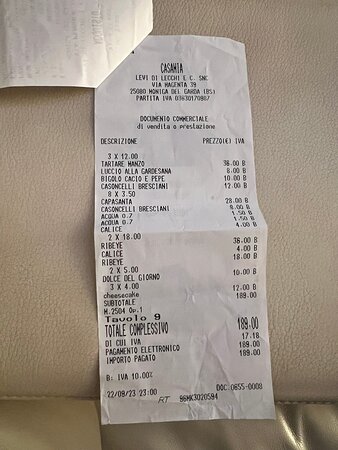
Locate an element on the screen. The image size is (338, 450). stapler is located at coordinates (132, 60).